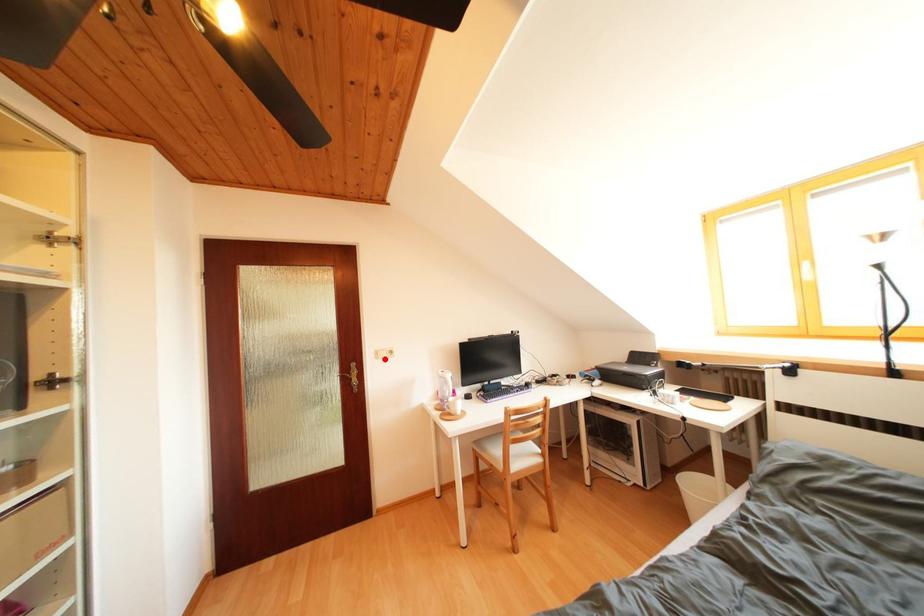
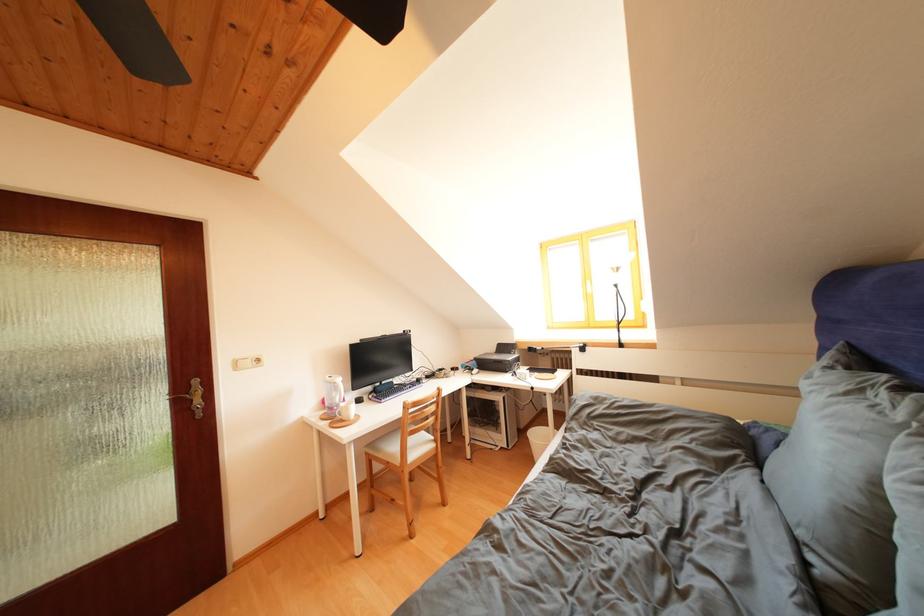
The point at the highlighted location is marked in the first image. Where is the corresponding point in the second image?

(244, 369)